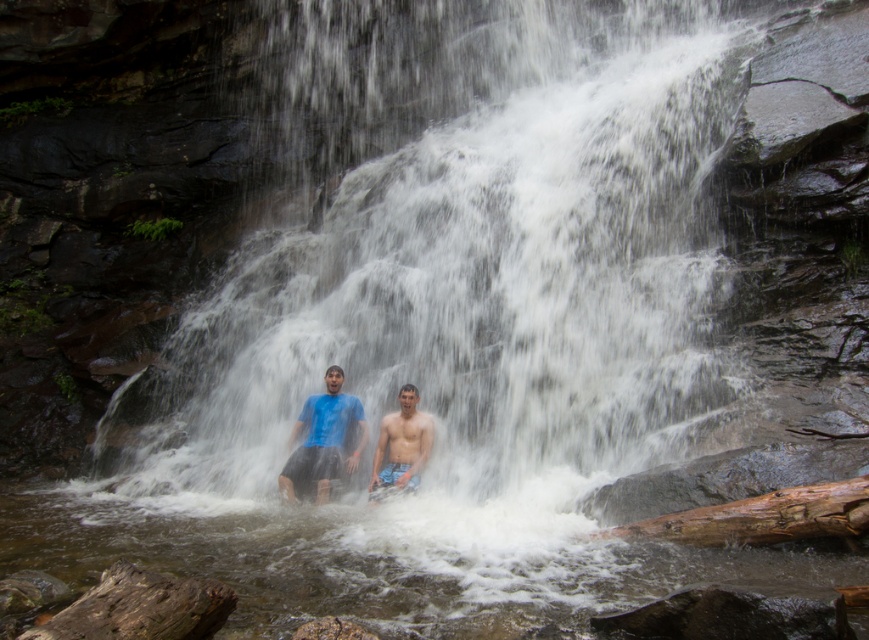
You are a photographer trying to capture a clear shot of both the blue matte shirt at center and the blue fabric shorts at lower center. Which object should you focus on first to ensure it appears sharp in the photo?

You should focus on the blue matte shirt at center first because it is closer to you than the blue fabric shorts at lower center, making it the foreground object.

You are a photographer trying to capture the two people in the waterfall scene. You notice the blue matte shirt at center and the blue fabric shorts at lower center. Which clothing item is positioned lower in the image?

The blue matte shirt at center is located below the blue fabric shorts at lower center, so the blue matte shirt at center is positioned lower in the image.